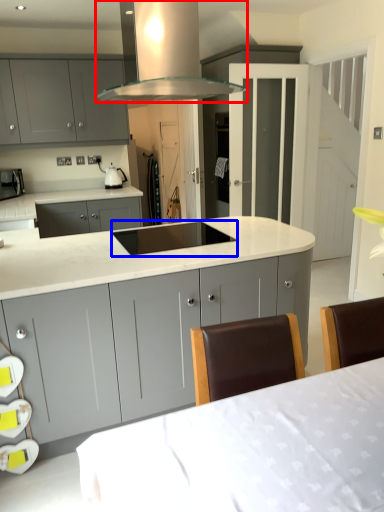
Question: Which point is further to the camera, home appliance (highlighted by a red box) or sink (highlighted by a blue box)?

Choices:
 (A) home appliance
 (B) sink

Answer: (B)